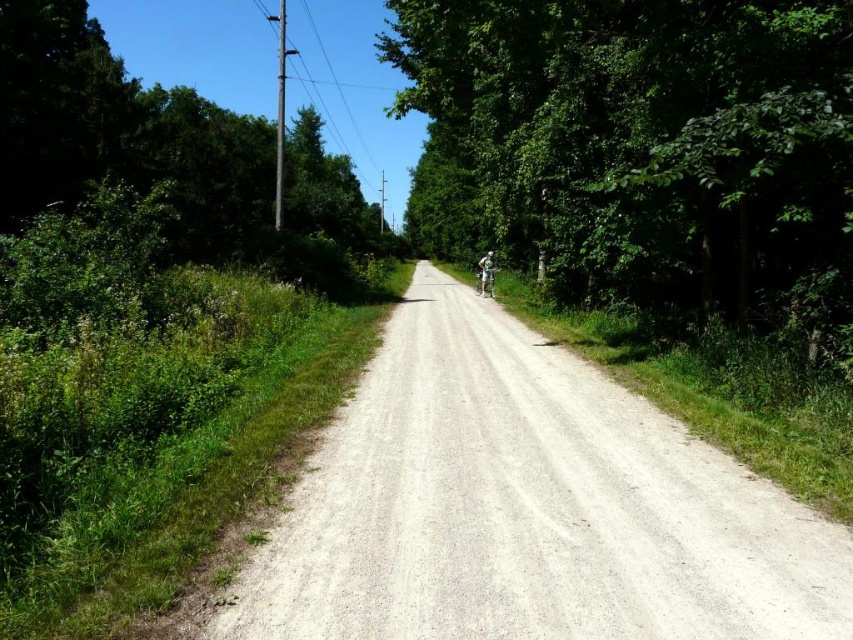
You are standing at the starting point of the gray gravel road at center and want to walk to a friend waiting at the end of the road. If your walking speed is 1.5 meters per second, how many seconds will it take you to reach your friend?

The gray gravel road at center and viewer are 29.59 meters apart from each other. To reach the friend at the end, it would take 29.59 meters divided by 1.5 meters per second, which equals approximately 19.73 seconds.

You are a photographer standing on the gravel road. You see the green leafy tree at left and the metallic silver bicycle at center. Which object is higher in the image?

The green leafy tree at left is above the metallic silver bicycle at center, so it is higher in the image.

You are planning to cross the gray gravel road at center while avoiding the green leafy tree at center. What is the minimum distance you need to move sideways from the road to safely bypass the tree?

The gray gravel road at center and green leafy tree at center are 273.60 feet apart, so you need to move sideways at least 273.60 feet to safely bypass the tree.